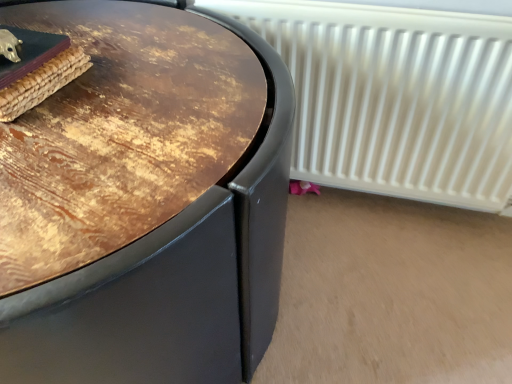
At what (x,y) coordinates should I click in order to perform the action: click on space that is in front of white matte radiator at upper right. Please return your answer as a coordinate pair (x, y). The height and width of the screenshot is (384, 512). Looking at the image, I should click on (370, 257).